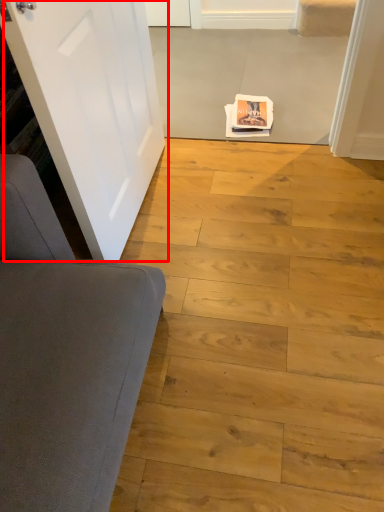
Question: In this image, where is door (annotated by the red box) located relative to plank?

Choices:
 (A) left
 (B) right

Answer: (A)